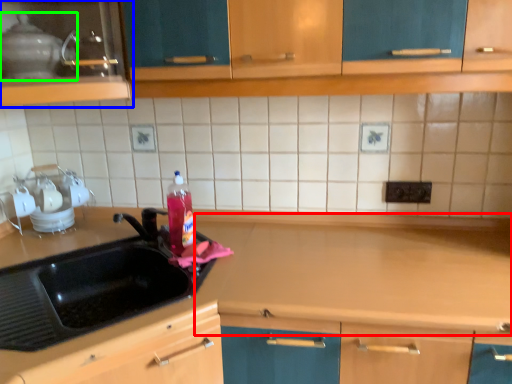
Question: Which is nearer to the counter top (highlighted by a red box)? cabinetry (highlighted by a blue box) or appliance (highlighted by a green box).

Choices:
 (A) cabinetry
 (B) appliance

Answer: (A)